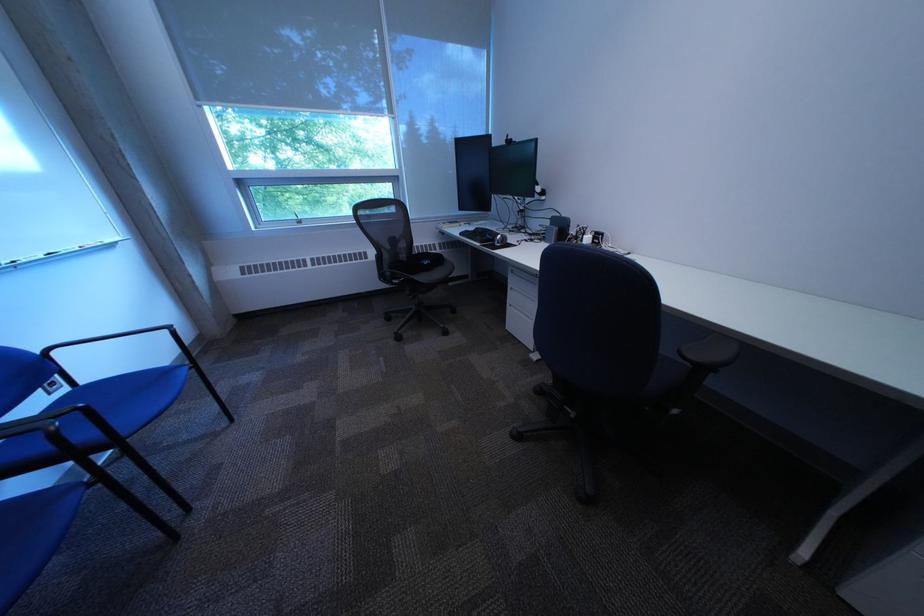
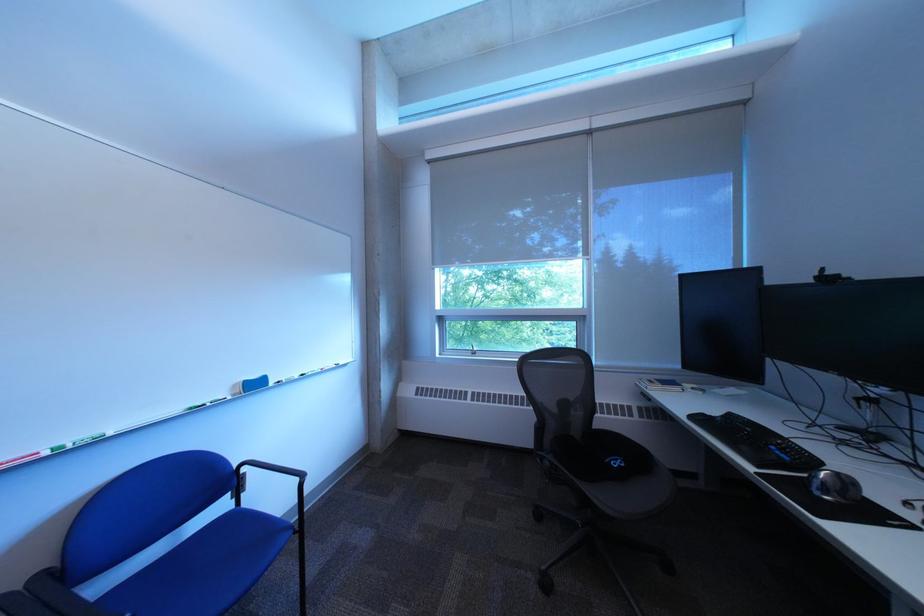
Locate, in the second image, the point that corresponds to pixel 404 275 in the first image.

(563, 464)